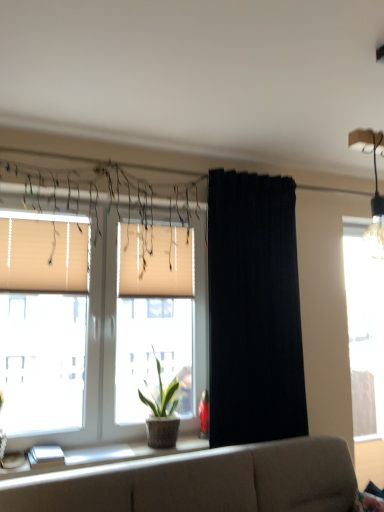
Question: Which direction should I rotate to face beige fabric window at center, the 2th window in the back-to-front sequence, — up or down?

Choices:
 (A) down
 (B) up

Answer: (A)

Question: Is beige fabric blinds at left, marked as the first window blind in a left-to-right arrangement, far away from beige fabric couch at lower center?

Choices:
 (A) no
 (B) yes

Answer: (B)

Question: Considering the relative sizes of beige fabric blinds at left, marked as the first window blind in a left-to-right arrangement, and beige fabric couch at lower center in the image provided, is beige fabric blinds at left, marked as the first window blind in a left-to-right arrangement, wider than beige fabric couch at lower center?

Choices:
 (A) no
 (B) yes

Answer: (A)

Question: Can you confirm if beige fabric blinds at left, which is counted as the second window blind, starting from the right, is taller than beige fabric couch at lower center?

Choices:
 (A) yes
 (B) no

Answer: (B)

Question: Does beige fabric blinds at left, marked as the first window blind in a left-to-right arrangement, have a lesser height compared to beige fabric couch at lower center?

Choices:
 (A) yes
 (B) no

Answer: (A)

Question: From the image's perspective, is beige fabric blinds at left, the first window blind positioned from the front, located beneath beige fabric couch at lower center?

Choices:
 (A) no
 (B) yes

Answer: (A)

Question: Is beige fabric blinds at left, marked as the first window blind in a left-to-right arrangement, completely or partially outside of beige fabric couch at lower center?

Choices:
 (A) yes
 (B) no

Answer: (A)

Question: Is beige fabric blinds at left, marked as the first window blind in a left-to-right arrangement, surrounded by transparent glass window at right, the first window positioned from the back?

Choices:
 (A) yes
 (B) no

Answer: (B)

Question: From the image's perspective, does transparent glass window at right, the first window positioned from the back, appear higher than beige fabric blinds at left, marked as the first window blind in a left-to-right arrangement?

Choices:
 (A) yes
 (B) no

Answer: (B)

Question: Can you confirm if transparent glass window at right, the second window viewed from the front, is taller than beige fabric blinds at left, marked as the first window blind in a left-to-right arrangement?

Choices:
 (A) yes
 (B) no

Answer: (A)

Question: Would you say transparent glass window at right, arranged as the 2th window when viewed from the left, is outside beige fabric blinds at left, marked as the first window blind in a left-to-right arrangement?

Choices:
 (A) yes
 (B) no

Answer: (A)

Question: Is transparent glass window at right, the first window positioned from the back, behind beige fabric blinds at left, which is counted as the second window blind, starting from the right?

Choices:
 (A) yes
 (B) no

Answer: (A)

Question: Could you tell me if transparent glass window at right, arranged as the 2th window when viewed from the left, is turned towards beige fabric blinds at left, the first window blind positioned from the front?

Choices:
 (A) no
 (B) yes

Answer: (A)

Question: From the image's perspective, would you say white glossy window sill at lower left is positioned over white pleated blinds at center, the 2th window blind viewed from the left?

Choices:
 (A) no
 (B) yes

Answer: (A)